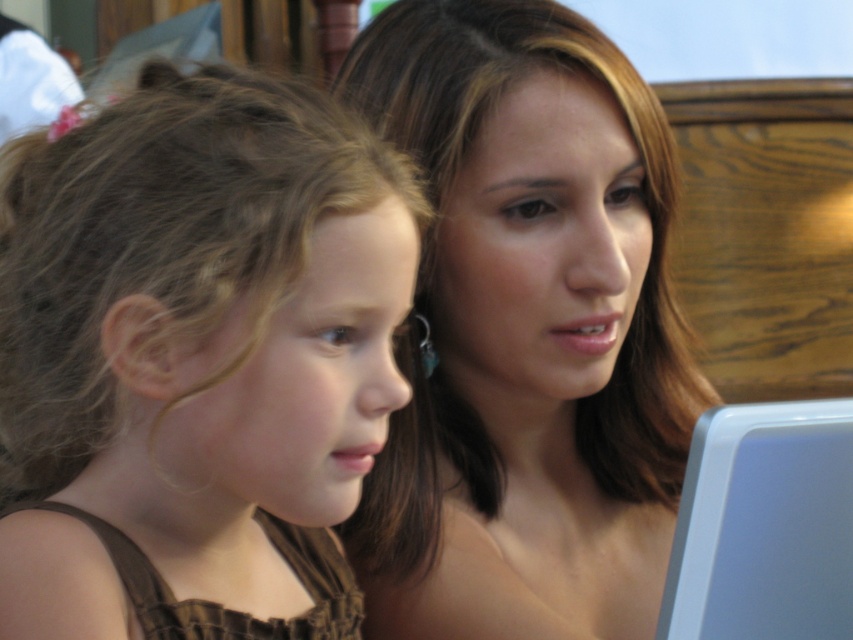
Does brown fabric dress at left have a lesser width compared to matte skin tone at center?

Yes, brown fabric dress at left is thinner than matte skin tone at center.

Is the position of brown fabric dress at left more distant than that of matte skin tone at center?

That is False.

Is point (244, 429) positioned before point (486, 97)?

Yes, point (244, 429) is closer to viewer.

Locate an element on the screen. Image resolution: width=853 pixels, height=640 pixels. brown fabric dress at left is located at coordinates (195, 358).

Does brown fabric dress at left have a greater height compared to white plastic laptop at lower right?

Yes.

Is brown fabric dress at left to the left of white plastic laptop at lower right from the viewer's perspective?

Indeed, brown fabric dress at left is positioned on the left side of white plastic laptop at lower right.

Find the location of a particular element. The image size is (853, 640). brown fabric dress at left is located at coordinates [195, 358].

Find the location of a particular element. brown fabric dress at left is located at coordinates (195, 358).

Between matte skin tone at center and white plastic laptop at lower right, which one has more height?

Standing taller between the two is matte skin tone at center.

Can you confirm if matte skin tone at center is shorter than white plastic laptop at lower right?

No, matte skin tone at center is not shorter than white plastic laptop at lower right.

Where is `matte skin tone at center`? This screenshot has height=640, width=853. matte skin tone at center is located at coordinates (526, 332).